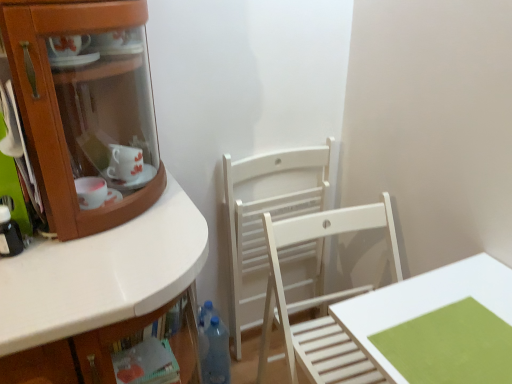
Question: Does translucent plastic bottle at left, the second bottle viewed from the back, have a greater height compared to white matte table at lower right?

Choices:
 (A) yes
 (B) no

Answer: (B)

Question: Can you confirm if translucent plastic bottle at left, the 1th bottle when ordered from left to right, is thinner than white matte table at lower right?

Choices:
 (A) yes
 (B) no

Answer: (A)

Question: Does translucent plastic bottle at left, which ranks as the 1th bottle in top-to-bottom order, appear on the left side of white matte table at lower right?

Choices:
 (A) no
 (B) yes

Answer: (B)

Question: Can you confirm if translucent plastic bottle at left, the 1th bottle when ordered from left to right, is wider than white matte table at lower right?

Choices:
 (A) no
 (B) yes

Answer: (A)

Question: Considering the relative sizes of translucent plastic bottle at left, the second bottle viewed from the back, and white matte table at lower right in the image provided, is translucent plastic bottle at left, the second bottle viewed from the back, shorter than white matte table at lower right?

Choices:
 (A) no
 (B) yes

Answer: (B)

Question: Which is correct: translucent plastic bottle at left, which ranks as the 1th bottle in top-to-bottom order, is inside transparent plastic bottle at lower center, which is counted as the first bottle, starting from the bottom, or outside of it?

Choices:
 (A) outside
 (B) inside

Answer: (A)

Question: Is translucent plastic bottle at left, which ranks as the first bottle in front-to-back order, bigger or smaller than transparent plastic bottle at lower center, which appears as the 1th bottle when viewed from the right?

Choices:
 (A) small
 (B) big

Answer: (A)

Question: In the image, is translucent plastic bottle at left, which ranks as the 1th bottle in top-to-bottom order, positioned in front of or behind transparent plastic bottle at lower center, positioned as the first bottle in back-to-front order?

Choices:
 (A) behind
 (B) front

Answer: (B)

Question: Would you say translucent plastic bottle at left, which ranks as the 1th bottle in top-to-bottom order, is to the left or to the right of transparent plastic bottle at lower center, the 2th bottle when ordered from top to bottom, in the picture?

Choices:
 (A) left
 (B) right

Answer: (A)

Question: Looking at their shapes, would you say white wood chair at center, the second chair from the front, is wider or thinner than white matte table at lower right?

Choices:
 (A) wide
 (B) thin

Answer: (B)

Question: From the image's perspective, is white wood chair at center, the second chair from the front, located above or below white matte table at lower right?

Choices:
 (A) below
 (B) above

Answer: (B)

Question: From their relative heights in the image, would you say white wood chair at center, the first chair from the back, is taller or shorter than white matte table at lower right?

Choices:
 (A) short
 (B) tall

Answer: (B)

Question: From a real-world perspective, relative to white matte table at lower right, is white wood chair at center, the first chair from the back, vertically above or below?

Choices:
 (A) above
 (B) below

Answer: (B)

Question: Considering their positions, is translucent plastic bottle at left, the second bottle viewed from the back, located in front of or behind white wooden chair at center, the 1th chair in the front-to-back sequence?

Choices:
 (A) front
 (B) behind

Answer: (B)

Question: Would you say translucent plastic bottle at left, which ranks as the 1th bottle in top-to-bottom order, is to the left or to the right of white wooden chair at center, the 1th chair in the front-to-back sequence, in the picture?

Choices:
 (A) left
 (B) right

Answer: (A)